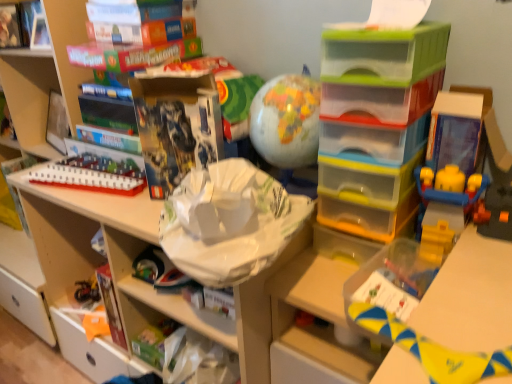
This screenshot has width=512, height=384. I want to click on space that is in front of white plastic train at upper left, which ranks as the third toy in right-to-left order, so click(106, 204).